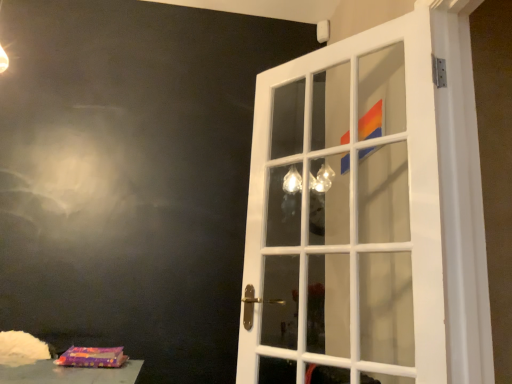
Question: Is purple fabric bag at lower left in front of or behind white glass door at center in the image?

Choices:
 (A) behind
 (B) front

Answer: (A)

Question: Based on their positions, is purple fabric bag at lower left located to the left or right of white glass door at center?

Choices:
 (A) left
 (B) right

Answer: (A)

Question: In terms of width, does purple fabric bag at lower left look wider or thinner when compared to white glass door at center?

Choices:
 (A) wide
 (B) thin

Answer: (B)

Question: Is white glass door at center taller or shorter than purple fabric bag at lower left?

Choices:
 (A) short
 (B) tall

Answer: (B)

Question: Would you say white glass door at center is to the left or to the right of purple fabric bag at lower left in the picture?

Choices:
 (A) right
 (B) left

Answer: (A)

Question: From a real-world perspective, is white glass door at center positioned above or below purple fabric bag at lower left?

Choices:
 (A) above
 (B) below

Answer: (A)

Question: Looking at their shapes, would you say white glass door at center is wider or thinner than purple fabric bag at lower left?

Choices:
 (A) thin
 (B) wide

Answer: (B)